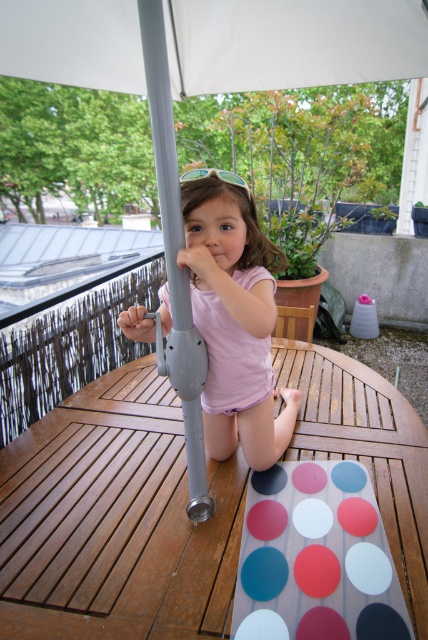
Does pink matte dress at center appear under matte gray pole at center?

Correct, pink matte dress at center is located below matte gray pole at center.

Based on the photo, is pink matte dress at center positioned behind matte gray pole at center?

That is True.

What are the coordinates of `pink matte dress at center` in the screenshot? It's located at (234, 321).

Between white fabric canopy at upper center and matte white circle at center, which one is positioned higher?

Positioned higher is white fabric canopy at upper center.

Is white fabric canopy at upper center positioned before matte white circle at center?

No, white fabric canopy at upper center is behind matte white circle at center.

The width and height of the screenshot is (428, 640). Identify the location of white fabric canopy at upper center. (291, 42).

Which is more to the right, wooden table at center or matte gray pole at center?

From the viewer's perspective, matte gray pole at center appears more on the right side.

Between wooden table at center and matte gray pole at center, which one is positioned lower?

wooden table at center

Between point (107, 426) and point (198, 445), which one is positioned behind?

The point (107, 426) is more distant.

Where is `wooden table at center`? The width and height of the screenshot is (428, 640). wooden table at center is located at coordinates (115, 520).